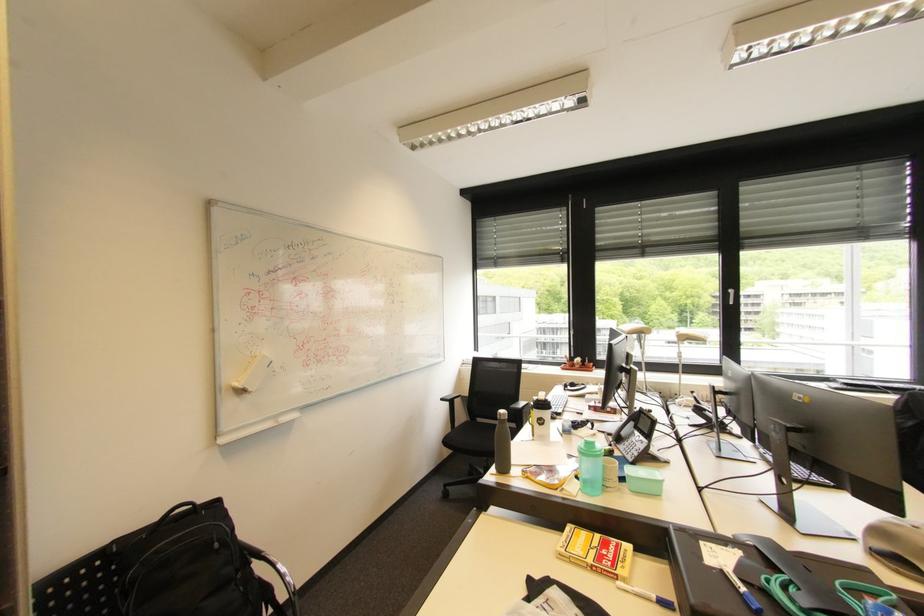
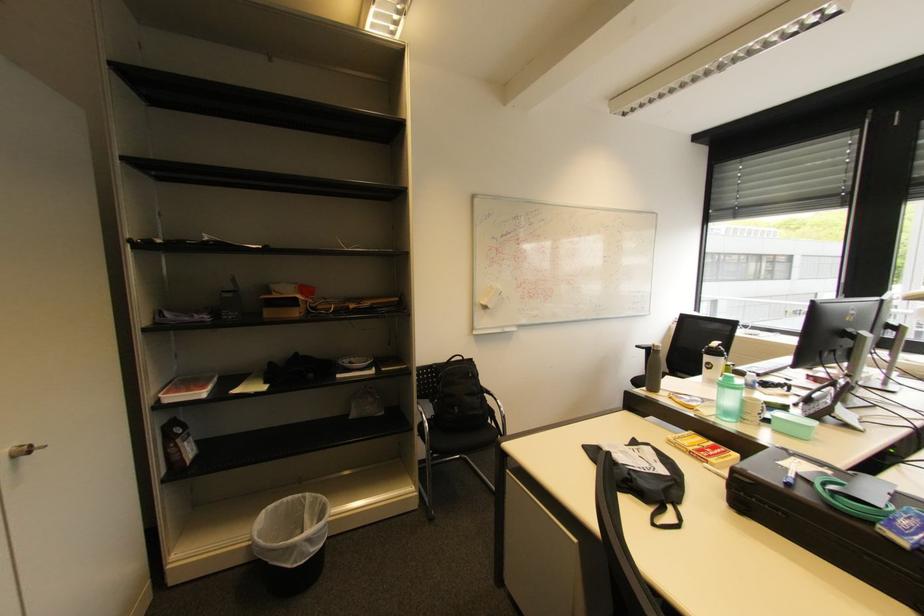
Question: The images are taken continuously from a first-person perspective. In which direction is your viewpoint rotating?

Choices:
 (A) Left
 (B) Right
 (C) Up
 (D) Down

Answer: (A)